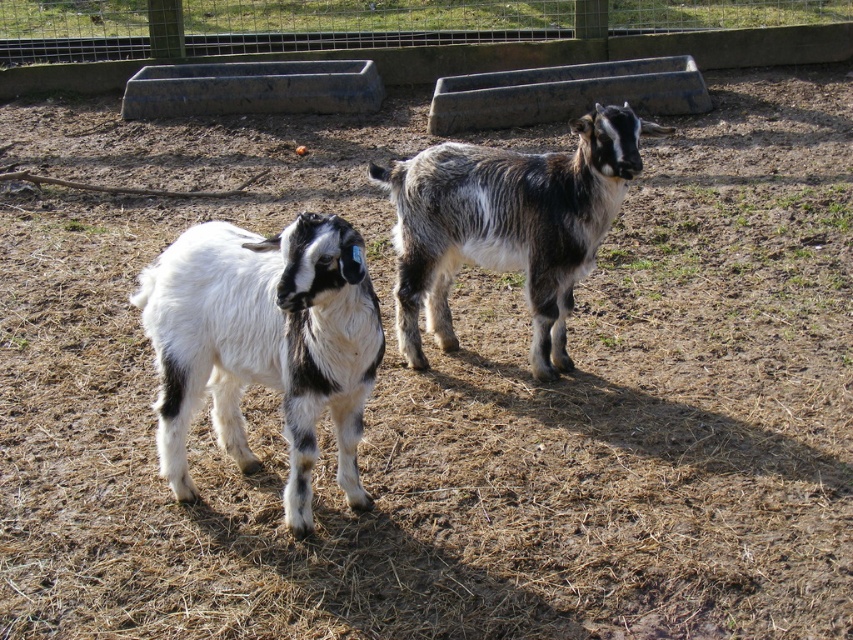
Question: Does white woolen goat at center appear on the left side of speckled woolen goat at center?

Choices:
 (A) no
 (B) yes

Answer: (B)

Question: Is white woolen goat at center further to the viewer compared to speckled woolen goat at center?

Choices:
 (A) yes
 (B) no

Answer: (B)

Question: Which point is farther to the camera?

Choices:
 (A) speckled woolen goat at center
 (B) white woolen goat at center

Answer: (A)

Question: Does white woolen goat at center appear on the left side of speckled woolen goat at center?

Choices:
 (A) no
 (B) yes

Answer: (B)

Question: Which of the following is the farthest from the observer?

Choices:
 (A) 550,227
 (B) 164,301

Answer: (A)